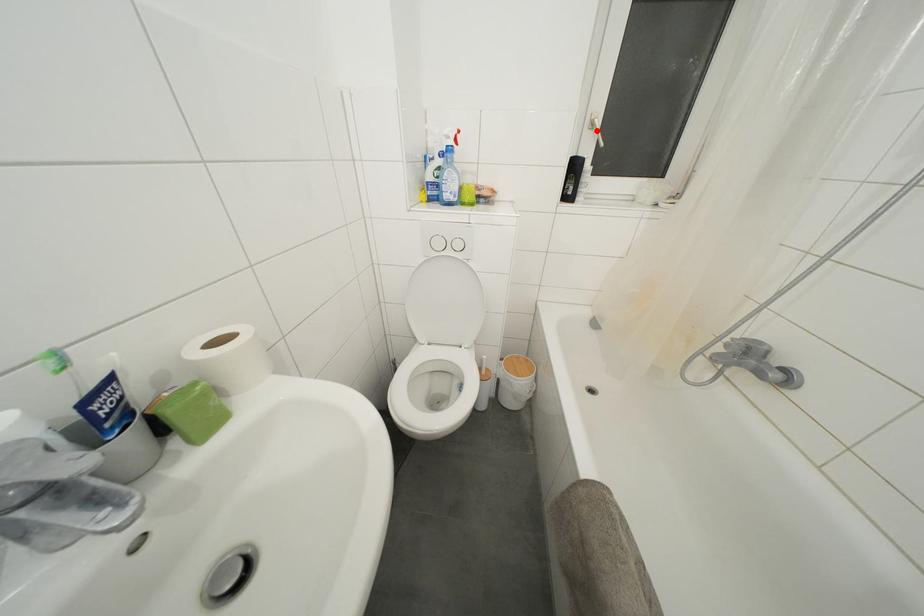
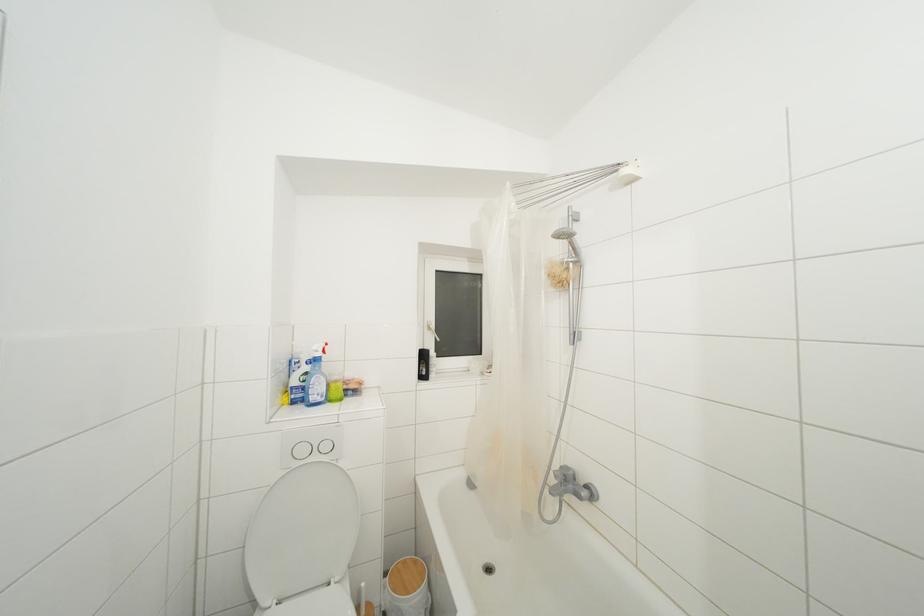
Find the pixel in the second image that matches the highlighted location in the first image.

(433, 333)